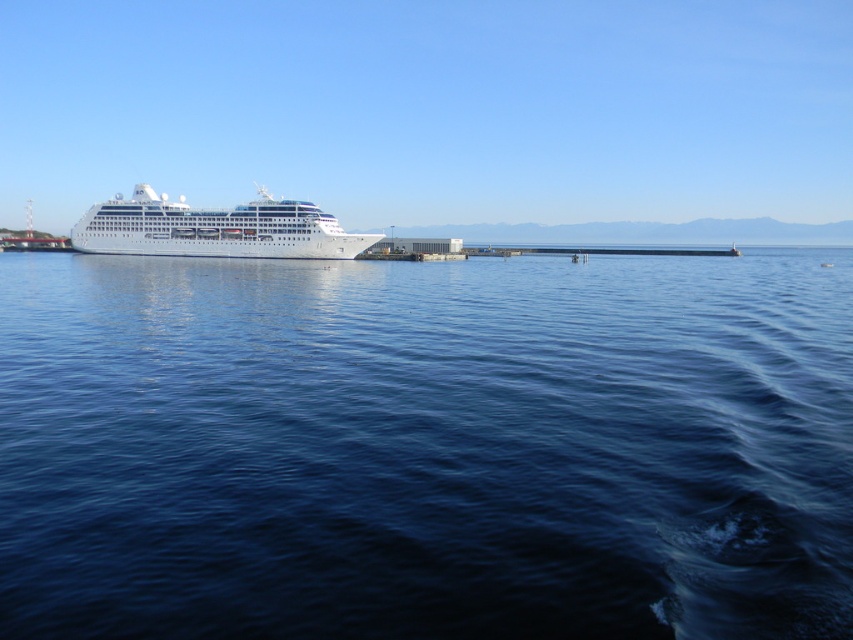
You are standing on the pier and looking at the blue liquid water at center and the white glossy cruise ship at center. Which object is nearer to you?

The blue liquid water at center is closer to the viewer than the white glossy cruise ship at center.

You are a passenger on the white glossy cruise ship at center. You want to get to the blue liquid water at center to take a swim. Which direction should you go from the ship to reach the water?

The blue liquid water at center is to the right of the white glossy cruise ship at center, so you should go to the right to reach the water.